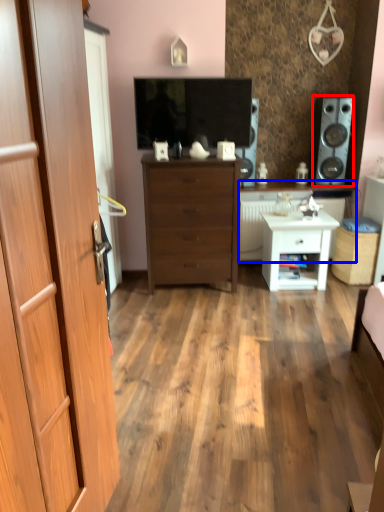
Question: Among these objects, which one is nearest to the camera, speaker (highlighted by a red box) or counter top (highlighted by a blue box)?

Choices:
 (A) speaker
 (B) counter top

Answer: (A)